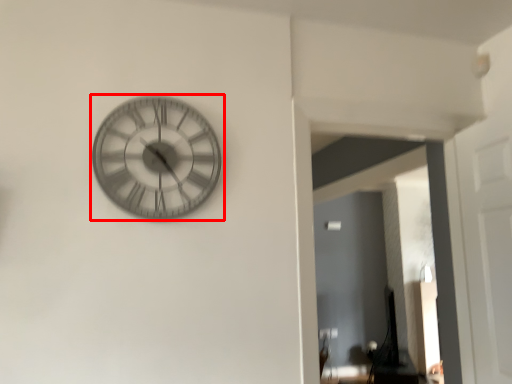
Question: Considering the relative positions of wall clock (annotated by the red box) and glass door in the image provided, where is wall clock (annotated by the red box) located with respect to the staircase?

Choices:
 (A) left
 (B) right

Answer: (A)